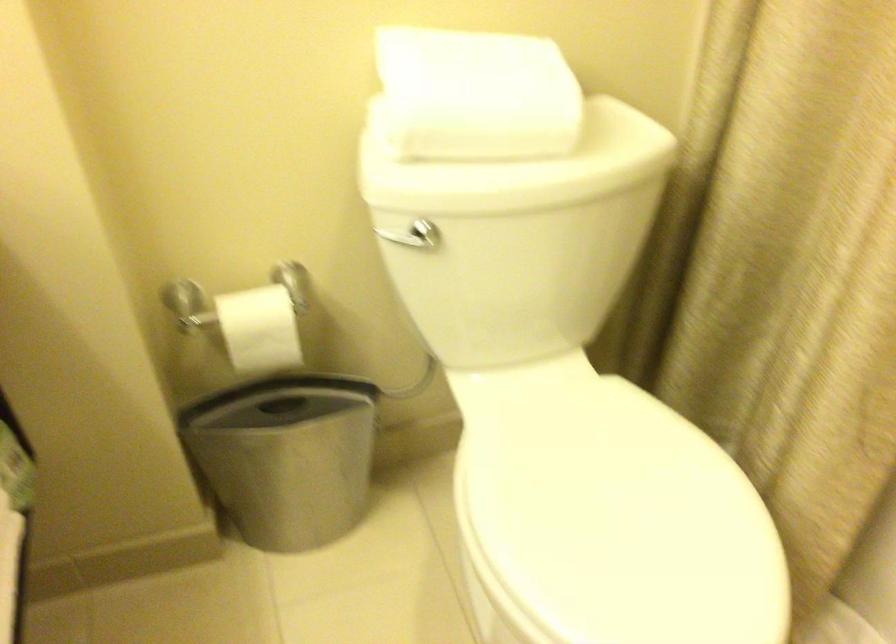
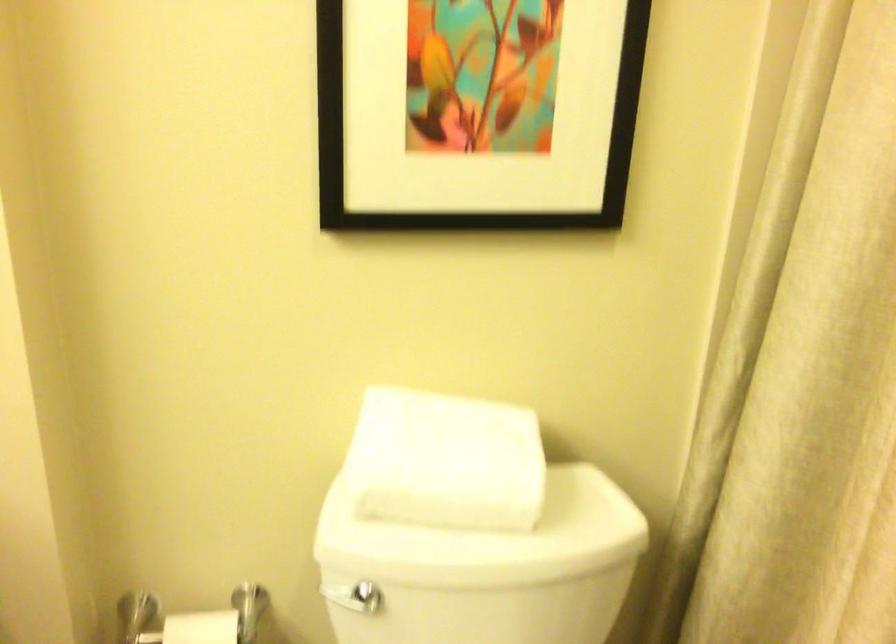
Locate, in the second image, the point that corresponds to (252,301) in the first image.

(201, 627)